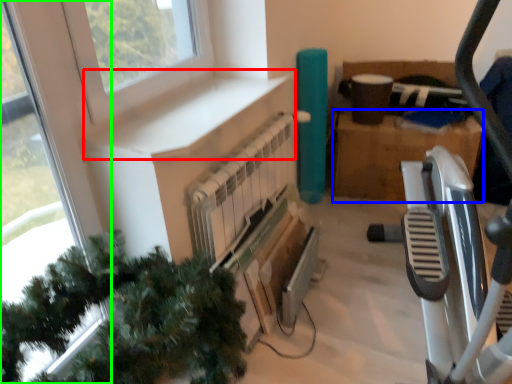
Question: Which object is the farthest from window sill (highlighted by a red box)? Choose among these: cardboard box (highlighted by a blue box) or window (highlighted by a green box).

Choices:
 (A) cardboard box
 (B) window

Answer: (A)